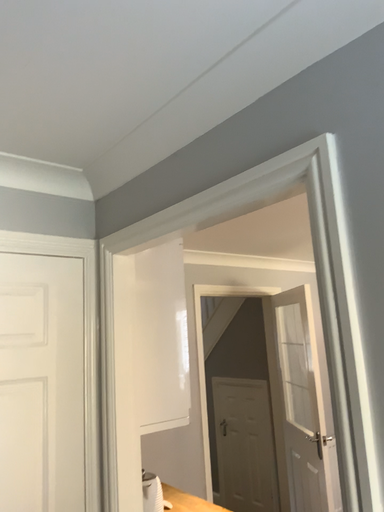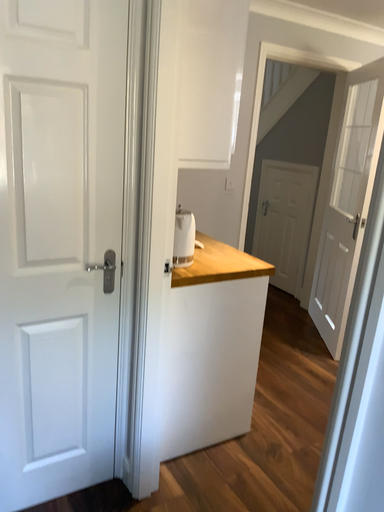
Question: Which way did the camera rotate in the video?

Choices:
 (A) rotated upward
 (B) rotated downward

Answer: (B)